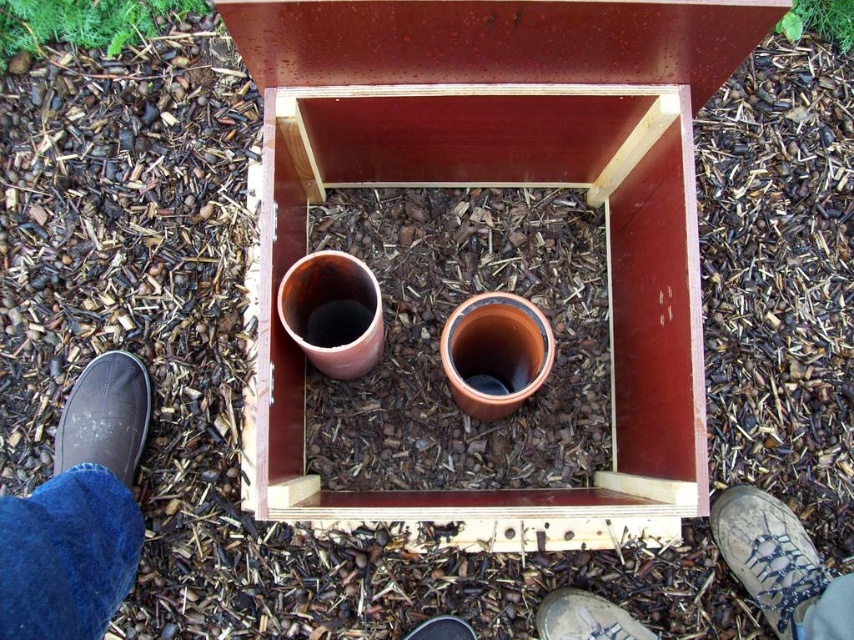
Is camouflage fabric boot at lower right shorter than dark gray canvas shoe at lower left?

Incorrect, camouflage fabric boot at lower right's height does not fall short of dark gray canvas shoe at lower left's.

Between camouflage fabric boot at lower right and dark gray canvas shoe at lower left, which one appears on the right side from the viewer's perspective?

camouflage fabric boot at lower right

Does point (752, 506) lie in front of point (130, 356)?

Yes, point (752, 506) is in front of point (130, 356).

Locate an element on the screen. This screenshot has height=640, width=854. camouflage fabric boot at lower right is located at coordinates tap(781, 564).

Can you confirm if terracotta clay pots at center is bigger than camouflage fabric boot at lower right?

Indeed, terracotta clay pots at center has a larger size compared to camouflage fabric boot at lower right.

Is point (238, 12) farther from viewer compared to point (781, 531)?

No, (238, 12) is closer to viewer.

This screenshot has height=640, width=854. Identify the location of terracotta clay pots at center. (501, 182).

Measure the distance between dark blue denim jeans at lower left and black leather shoe at lower center.

They are 26.57 inches apart.

Does point (120, 429) lie behind point (466, 630)?

No, (120, 429) is in front of (466, 630).

Where is `dark blue denim jeans at lower left`? The width and height of the screenshot is (854, 640). dark blue denim jeans at lower left is located at coordinates (79, 513).